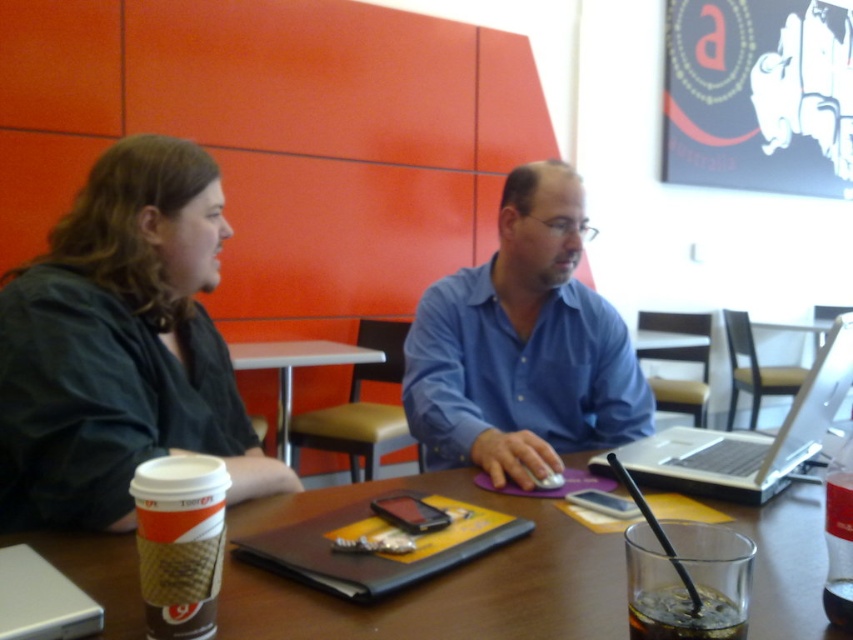
Is brown wooden table at center above brown leather table at center?

Incorrect, brown wooden table at center is not positioned above brown leather table at center.

Who is lower down, brown wooden table at center or brown leather table at center?

brown wooden table at center

This screenshot has height=640, width=853. What do you see at coordinates (438, 579) in the screenshot?
I see `brown wooden table at center` at bounding box center [438, 579].

You are a GUI agent. You are given a task and a screenshot of the screen. Output one action in this format:
    pyautogui.click(x=<x>, y=<y>)
    Task: Click on the brown wooden table at center
    The image size is (853, 640).
    Given the screenshot: What is the action you would take?
    pyautogui.click(x=438, y=579)

Can you confirm if dark green shirt at left is positioned above silver metallic laptop at center?

Indeed, dark green shirt at left is positioned over silver metallic laptop at center.

I want to click on dark green shirt at left, so click(120, 346).

Describe the element at coordinates (120, 346) in the screenshot. The image size is (853, 640). I see `dark green shirt at left` at that location.

In order to click on dark green shirt at left in this screenshot , I will do `click(120, 346)`.

Looking at this image, can you confirm if dark green shirt at left is taller than brown leather table at center?

Yes, dark green shirt at left is taller than brown leather table at center.

Between dark green shirt at left and brown leather table at center, which one has more height?

dark green shirt at left is taller.

Does point (100, 467) come closer to viewer compared to point (279, 403)?

Yes, point (100, 467) is closer to viewer.

At what (x,y) coordinates should I click in order to perform the action: click on dark green shirt at left. Please return your answer as a coordinate pair (x, y). Image resolution: width=853 pixels, height=640 pixels. Looking at the image, I should click on [x=120, y=346].